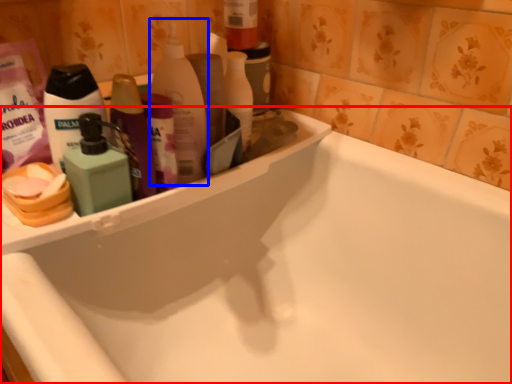
Question: Which of the following is the farthest to the observer, bathtub (highlighted by a red box) or cleaning product (highlighted by a blue box)?

Choices:
 (A) bathtub
 (B) cleaning product

Answer: (B)